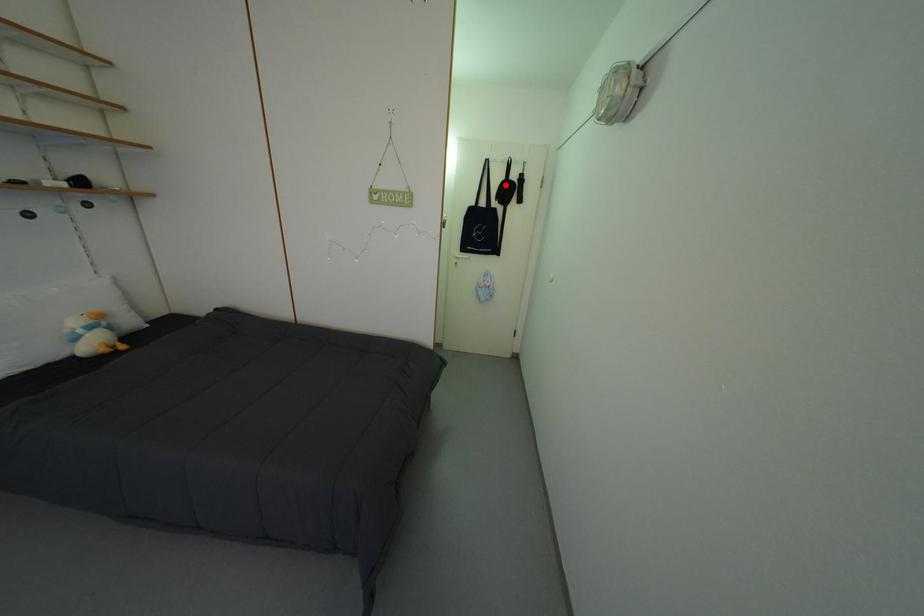
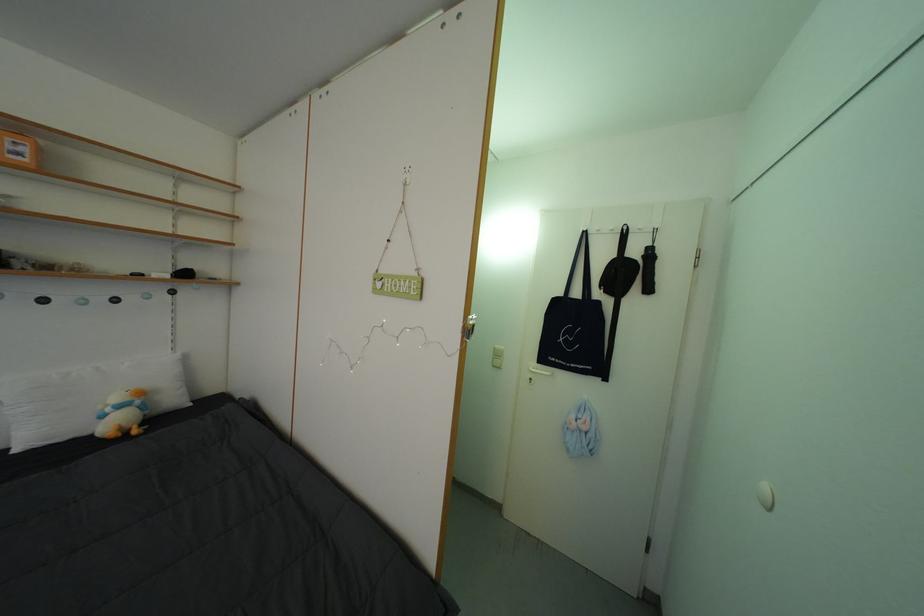
The point at the highlighted location is marked in the first image. Where is the corresponding point in the second image?

(611, 264)